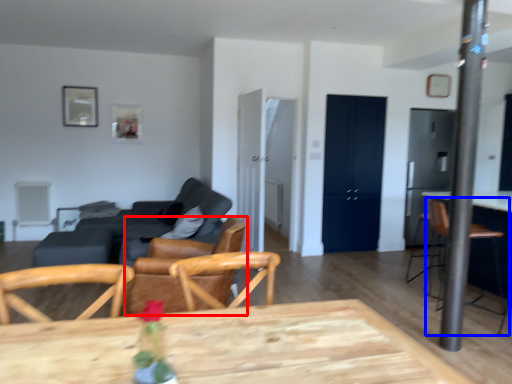
Question: Which object appears closest to the camera in this image, chair (highlighted by a red box) or armchair (highlighted by a blue box)?

Choices:
 (A) chair
 (B) armchair

Answer: (A)